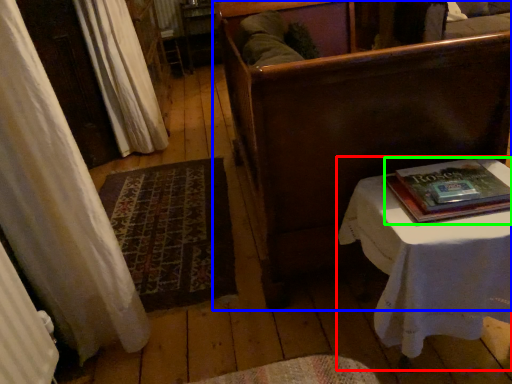
Question: Which is nearer to the table (highlighted by a red box)? furniture (highlighted by a blue box) or paperback book (highlighted by a green box).

Choices:
 (A) furniture
 (B) paperback book

Answer: (B)